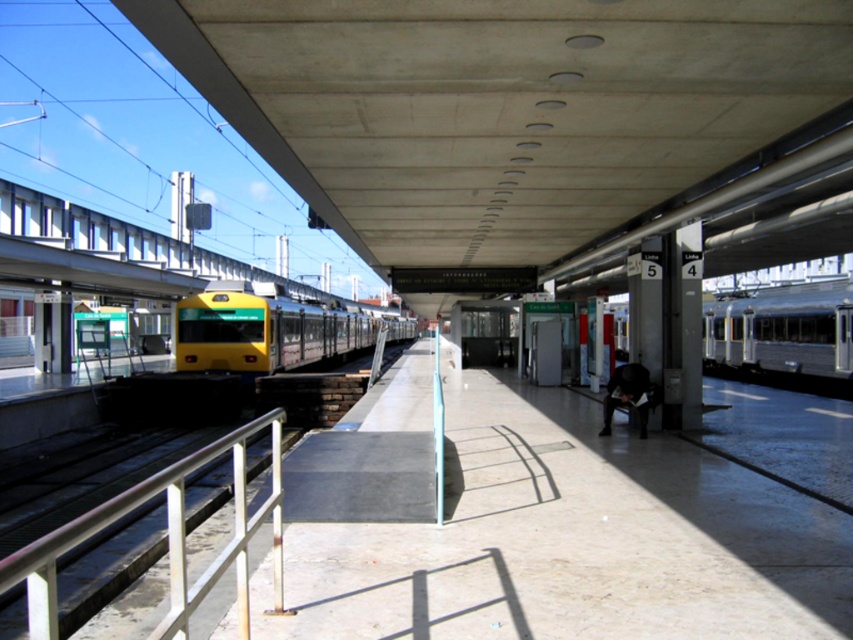
Can you confirm if white metal rail at lower left is positioned to the right of yellow metallic train at center?

Correct, you'll find white metal rail at lower left to the right of yellow metallic train at center.

Can you confirm if white metal rail at lower left is thinner than yellow metallic train at center?

In fact, white metal rail at lower left might be wider than yellow metallic train at center.

Find the location of a particular element. This screenshot has height=640, width=853. white metal rail at lower left is located at coordinates (166, 538).

Who is positioned more to the right, silver metallic train at right or yellow metallic train at center?

Positioned to the right is silver metallic train at right.

Does silver metallic train at right appear on the right side of yellow metallic train at center?

Yes, silver metallic train at right is to the right of yellow metallic train at center.

Measure the distance between point (816,300) and camera.

A distance of 21.83 meters exists between point (816,300) and camera.

At what (x,y) coordinates should I click in order to perform the action: click on silver metallic train at right. Please return your answer as a coordinate pair (x, y). The height and width of the screenshot is (640, 853). Looking at the image, I should click on (782, 333).

Is white metal rail at lower left behind silver metallic train at right?

No, it is in front of silver metallic train at right.

Between white metal rail at lower left and silver metallic train at right, which one appears on the left side from the viewer's perspective?

white metal rail at lower left is more to the left.

Who is more distant from viewer, (35, 552) or (793, 372)?

Point (793, 372)

Image resolution: width=853 pixels, height=640 pixels. I want to click on white metal rail at lower left, so click(x=166, y=538).